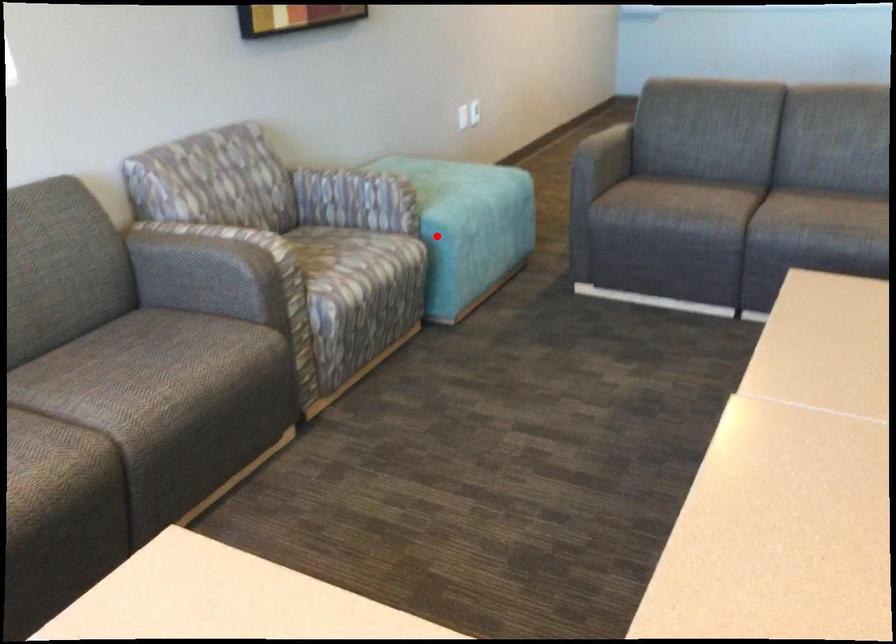
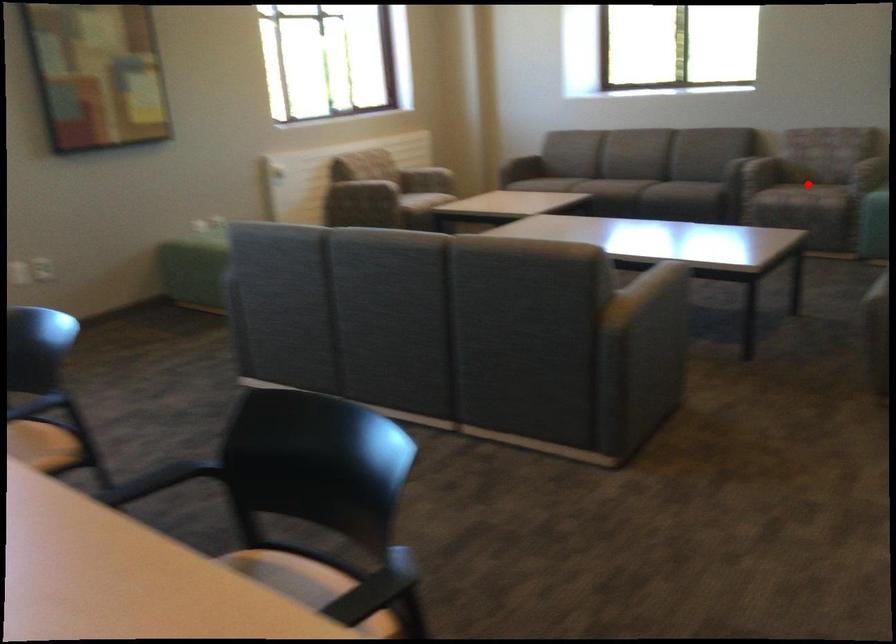
I am providing you with two images of the same scene from different viewpoints. A red point is marked on the first image and another point is marked on the second image. Are the points marked in image1 and image2 representing the same 3D position?

Yes